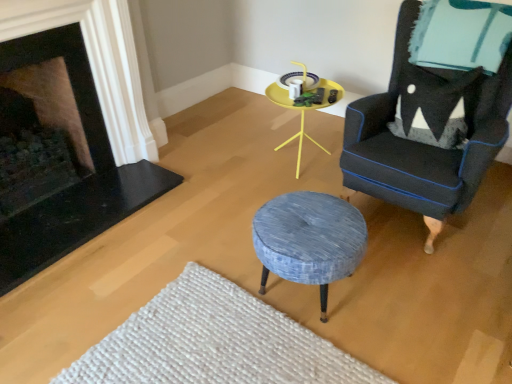
Find the location of `free spot to the right of black stone fireplace at left, marked as the first fireplace in a right-to-left arrangement`. free spot to the right of black stone fireplace at left, marked as the first fireplace in a right-to-left arrangement is located at coordinates (x=211, y=213).